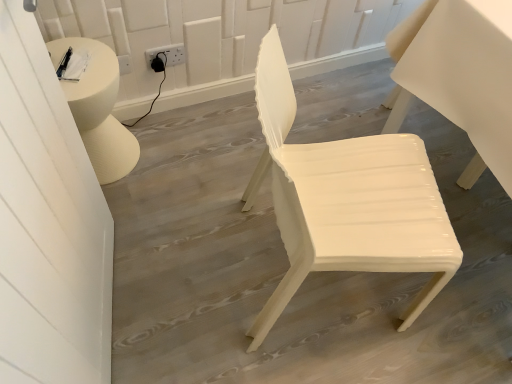
The image size is (512, 384). What are the coordinates of `free space that is to the left of glossy white chair at center` in the screenshot? It's located at (184, 255).